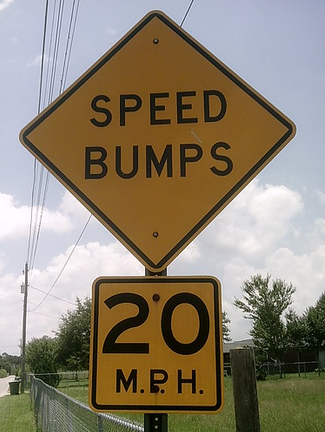
I want to click on large trash bucket, so click(13, 385).